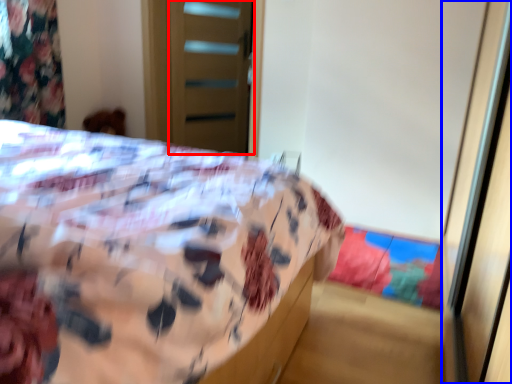
Question: Which object appears farthest to the camera in this image, screen door (highlighted by a red box) or screen door (highlighted by a blue box)?

Choices:
 (A) screen door
 (B) screen door

Answer: (A)